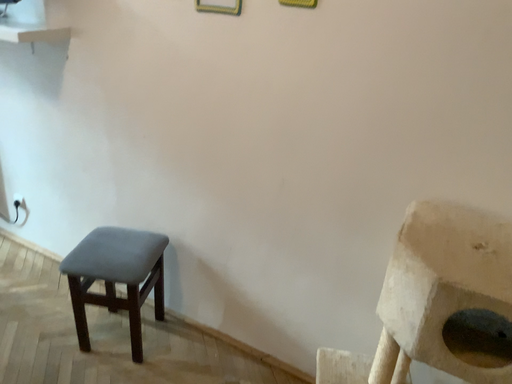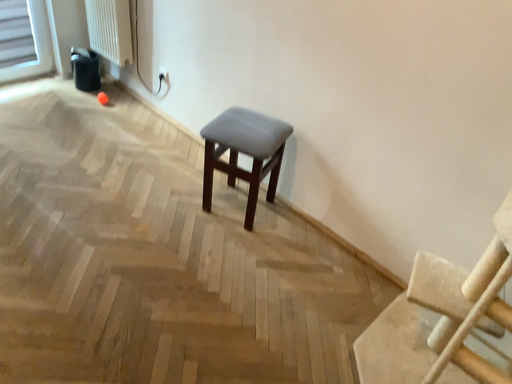
Question: How did the camera likely rotate when shooting the video?

Choices:
 (A) rotated left
 (B) rotated right

Answer: (A)